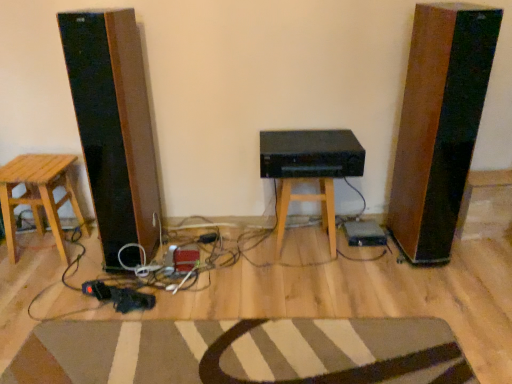
Find the location of a particular element. This screenshot has width=512, height=384. free spot below wooden stool at left, acting as the second stool starting from the right (from a real-world perspective) is located at coordinates (51, 247).